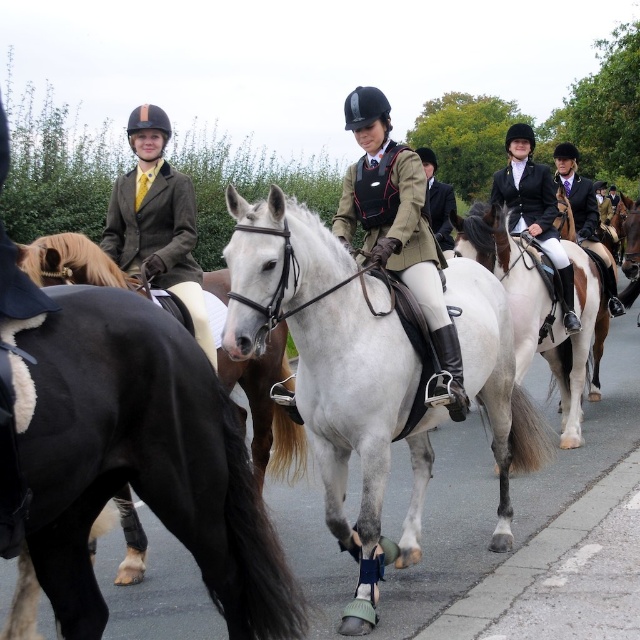
Question: Among these points, which one is farthest from the camera?

Choices:
 (A) (204, 333)
 (B) (593, 189)

Answer: (B)

Question: Which of the following is the closest to the observer?

Choices:
 (A) (324, 596)
 (B) (352, 120)
 (C) (502, 184)

Answer: (A)

Question: Which of the following is the closest to the observer?

Choices:
 (A) black leather jacket at center
 (B) matte black jacket at center
 (C) matte black vest at center

Answer: (C)

Question: Is white glossy horse at center closer to the viewer compared to matte black jacket at center?

Choices:
 (A) no
 (B) yes

Answer: (B)

Question: Is matte brown jacket at left above matte black jacket at center?

Choices:
 (A) no
 (B) yes

Answer: (A)

Question: Does matte black vest at center appear on the right side of matte black jacket at center?

Choices:
 (A) yes
 (B) no

Answer: (B)